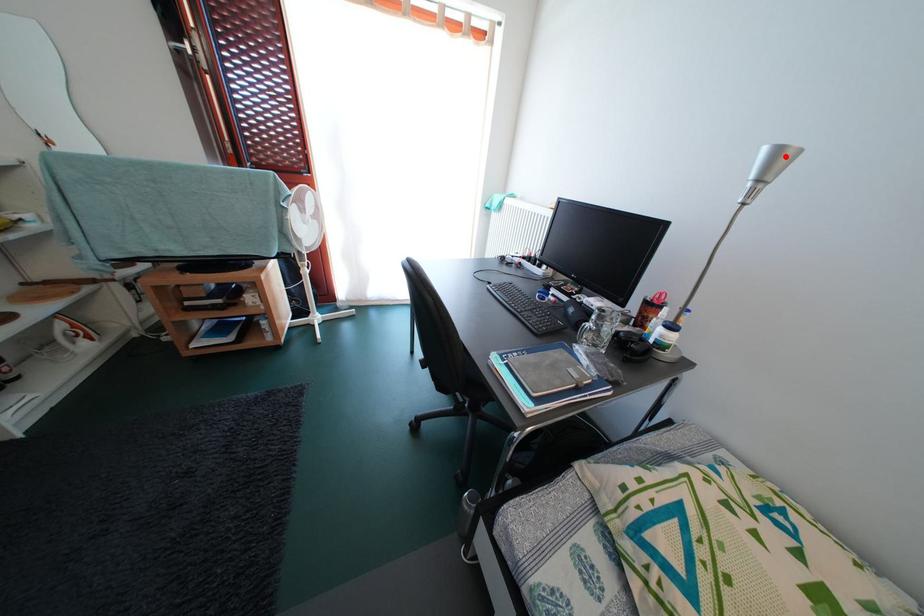
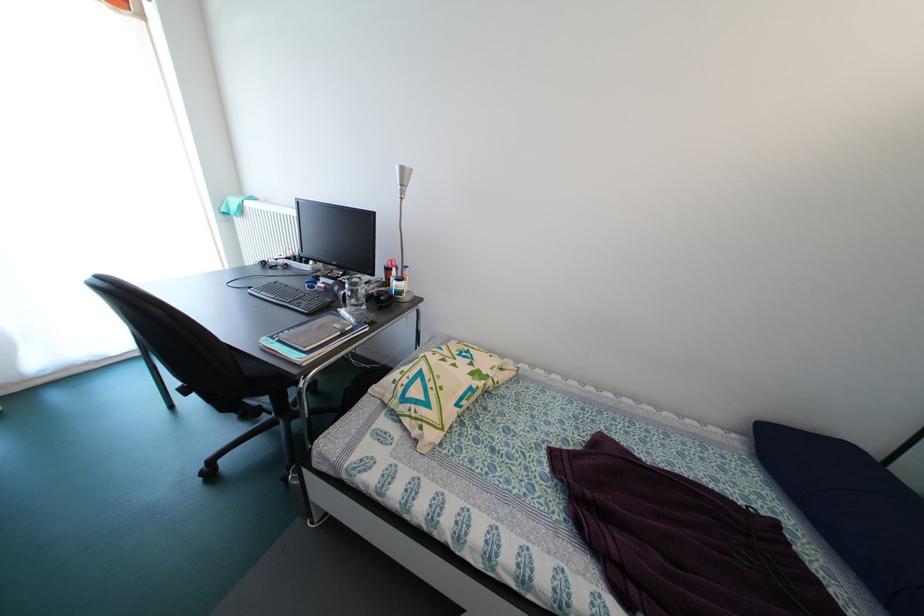
Where in the second image is the point corresponding to the highlighted location from the first image?

(409, 175)